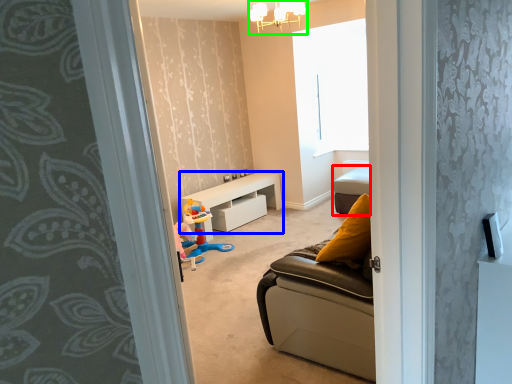
Question: Considering the real-world distances, which object is farthest from furniture (highlighted by a red box)? table (highlighted by a blue box) or light fixture (highlighted by a green box)?

Choices:
 (A) table
 (B) light fixture

Answer: (B)